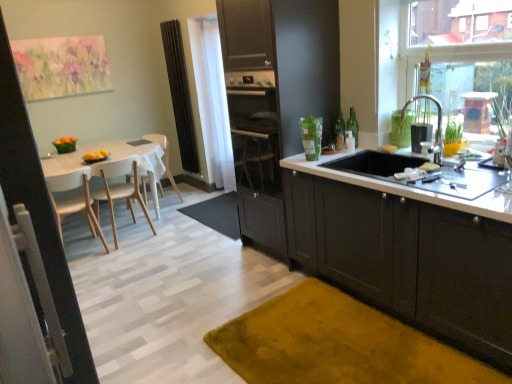
Question: Is point (379, 185) positioned closer to the camera than point (112, 208)?

Choices:
 (A) farther
 (B) closer

Answer: (B)

Question: In the image, is white glossy countertop at lower right positioned in front of or behind white wood chair at left, which is the 2th chair from front to back?

Choices:
 (A) front
 (B) behind

Answer: (A)

Question: Which is farther from the white sheer curtain at center?

Choices:
 (A) light wood chair at left, arranged as the 3th chair when viewed from the front
 (B) green glass bottle at upper right, placed as the second bottle when sorted from right to left
 (C) black rubber doormat at center, the 2th doormat in the bottom-to-top sequence
 (D) white wood table at left
 (E) matte black cabinets at lower right, the second cabinetry viewed from the left

Answer: (E)

Question: Estimate the real-world distances between objects in this image. Which object is farther from the white sheer curtain at center?

Choices:
 (A) glossy dark wood cabinets at center, the second cabinetry from the right
 (B) matte black cabinets at lower right, acting as the 1th cabinetry starting from the right
 (C) green glass bottle at upper right, which ranks as the first bottle in left-to-right order
 (D) white glossy screen door at upper left
 (E) transparent glass window at upper right

Answer: (D)